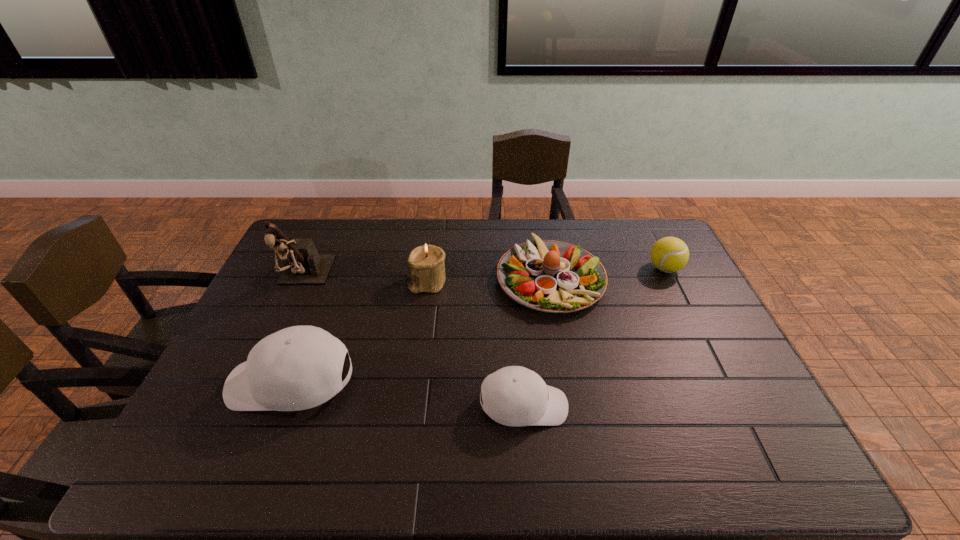
Locate an element on the screen. vacant space at the far edge is located at coordinates pyautogui.click(x=374, y=255).

This screenshot has width=960, height=540. What are the coordinates of `free space at the near edge of the desktop` in the screenshot? It's located at (626, 402).

Where is `vacant region at the right edge of the desktop`? The height and width of the screenshot is (540, 960). vacant region at the right edge of the desktop is located at coordinates (728, 395).

Image resolution: width=960 pixels, height=540 pixels. What are the coordinates of `free region at the near right corner of the desktop` in the screenshot? It's located at (727, 408).

This screenshot has height=540, width=960. What are the coordinates of `free point between the right baseball cap and the third object from left to right` in the screenshot? It's located at (476, 344).

Find the location of `free space between the candle_holder and the shorter baseball cap`. free space between the candle_holder and the shorter baseball cap is located at coordinates (476, 344).

You are a GUI agent. You are given a task and a screenshot of the screen. Output one action in this format:
    pyautogui.click(x=<x>, y=<y>)
    Task: Click on the free spot between the left baseball cap and the salad plate
    The height and width of the screenshot is (540, 960).
    Given the screenshot: What is the action you would take?
    pyautogui.click(x=420, y=330)

At what (x,y) coordinates should I click in order to perform the action: click on free space between the candle_holder and the salad plate. Please return your answer as a coordinate pair (x, y). This screenshot has width=960, height=540. Looking at the image, I should click on (489, 280).

Find the location of `free space that is in between the candle_holder and the taller baseball cap`. free space that is in between the candle_holder and the taller baseball cap is located at coordinates (360, 333).

Identify which object is the third nearest to the shorter baseball cap. Please provide its 2D coordinates. Your answer should be formatted as a tuple, i.e. [(x, y)], where the tuple contains the x and y coordinates of a point satisfying the conditions above.

[(426, 265)]